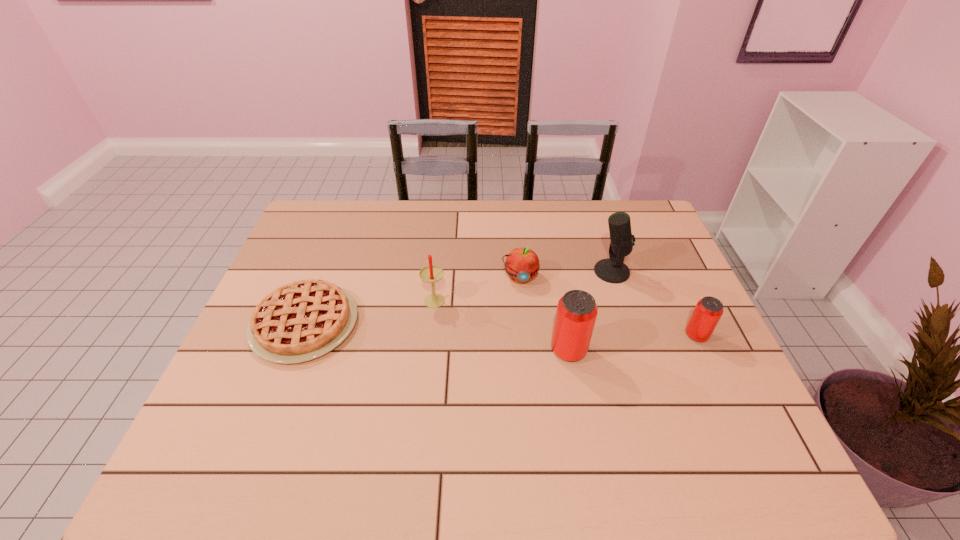
Find the location of a particular element. Image resolution: width=960 pixels, height=540 pixels. the third object from right to left is located at coordinates (576, 314).

This screenshot has height=540, width=960. What are the coordinates of `the taller can` in the screenshot? It's located at (576, 314).

Where is `the shorter can`? The width and height of the screenshot is (960, 540). the shorter can is located at coordinates (708, 311).

Identify the location of the right can. This screenshot has height=540, width=960. (708, 311).

The image size is (960, 540). I want to click on the third object from left to right, so click(521, 264).

This screenshot has width=960, height=540. Find the location of `the shortest object`. the shortest object is located at coordinates (300, 321).

Find the location of a particular element. pie is located at coordinates (300, 321).

The image size is (960, 540). Find the location of `microphone`. microphone is located at coordinates coord(612,270).

Locate an element on the screen. the fifth object from right to left is located at coordinates (431, 274).

The height and width of the screenshot is (540, 960). What are the coordinates of `vacant area situated 0.210m on the back of the left can` in the screenshot? It's located at (556, 281).